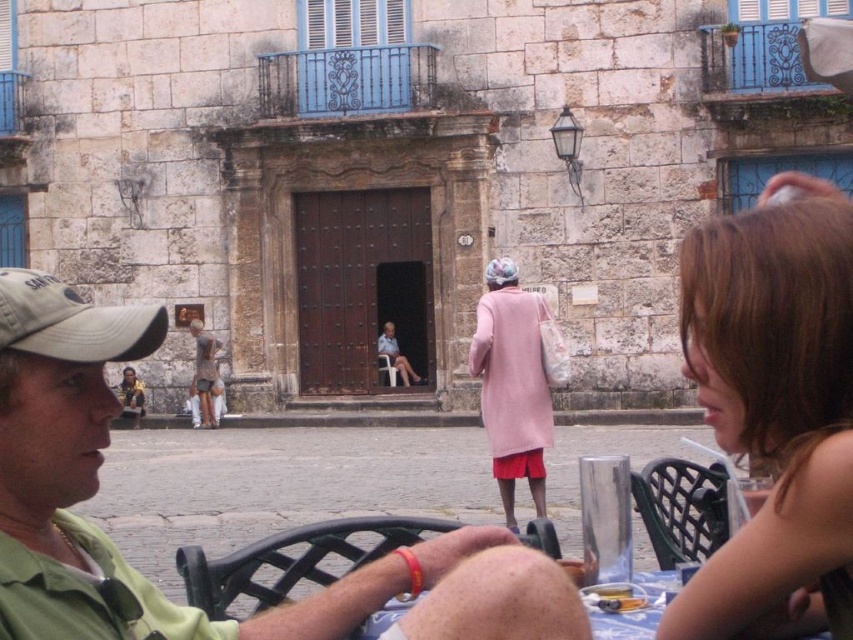
Question: From the image, what is the correct spatial relationship of brown hair at upper right in relation to pink fabric coat at center?

Choices:
 (A) right
 (B) left

Answer: (A)

Question: Is the position of brown hair at upper right more distant than that of brown wooden statue at center?

Choices:
 (A) no
 (B) yes

Answer: (A)

Question: Which of the following is the farthest from the observer?

Choices:
 (A) pink fabric coat at center
 (B) tan fabric baseball cap at left

Answer: (A)

Question: Among these points, which one is nearest to the camera?

Choices:
 (A) pyautogui.click(x=195, y=356)
 (B) pyautogui.click(x=457, y=536)
 (C) pyautogui.click(x=515, y=410)
 (D) pyautogui.click(x=62, y=300)

Answer: (D)

Question: Is green fabric shirt at lower left below tan fabric baseball cap at left?

Choices:
 (A) no
 (B) yes

Answer: (B)

Question: Which point is closer to the camera?

Choices:
 (A) tan fabric baseball cap at left
 (B) pink fabric coat at center

Answer: (A)